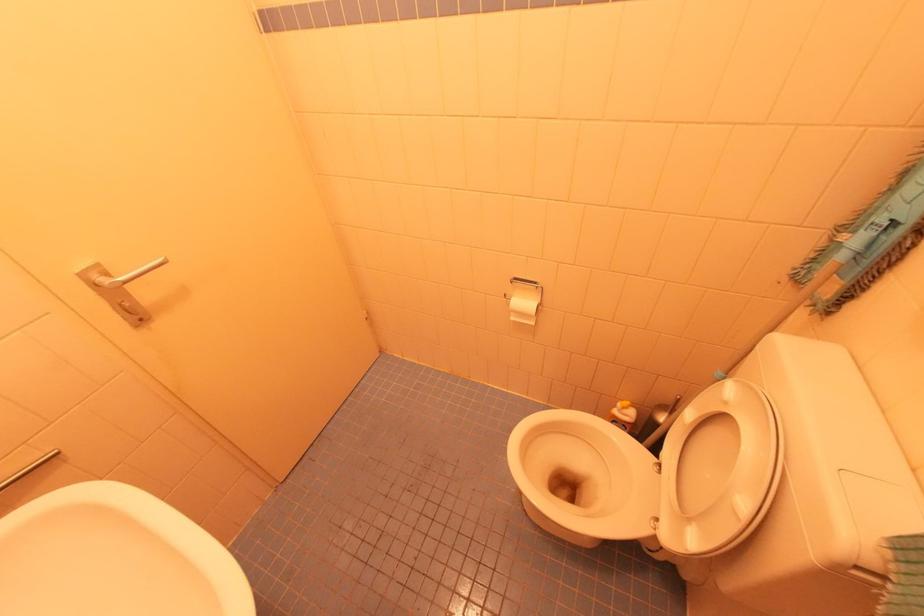
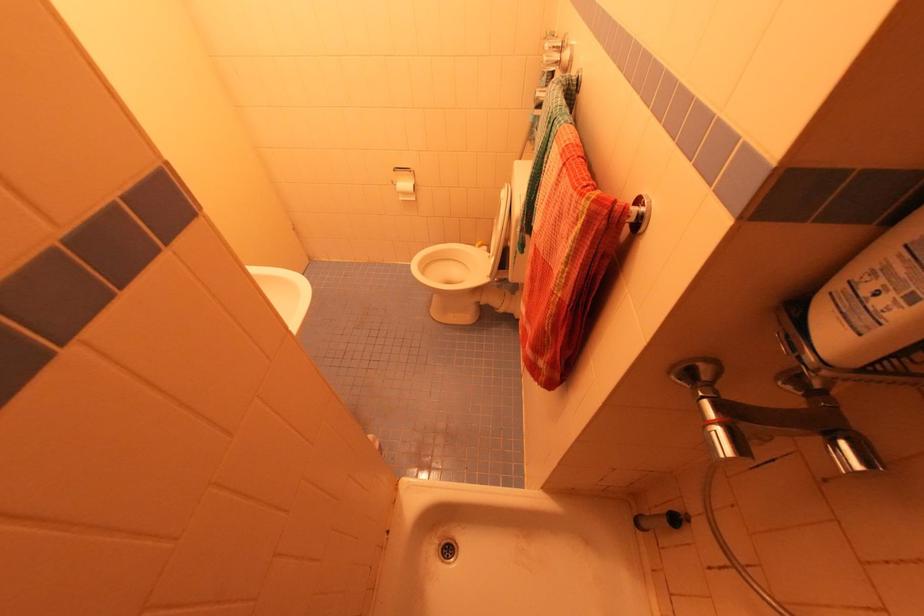
In the second image, find the point that corresponds to pixel 514 318 in the first image.

(403, 200)